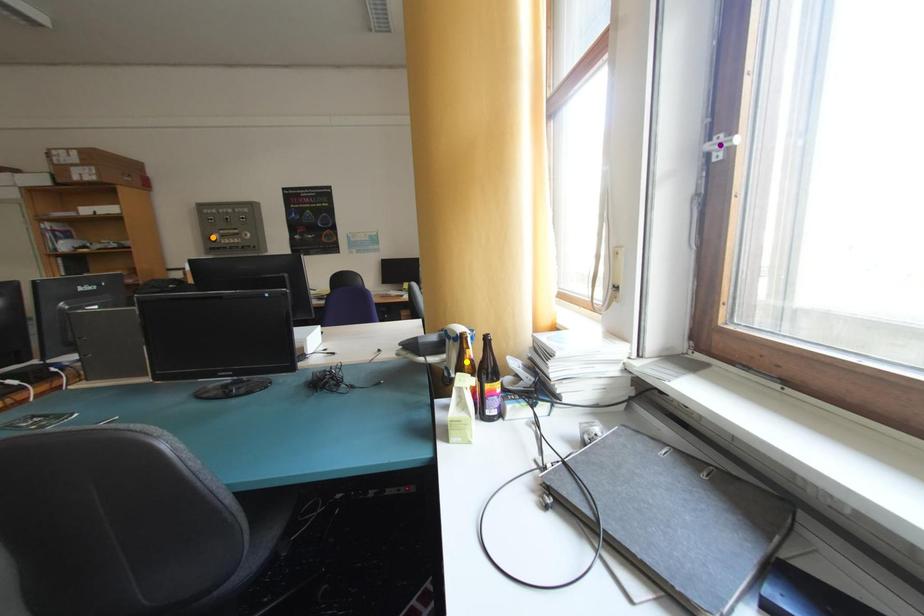
Order these from farthest to nearest:
purple point | yellow point | orange point

orange point, yellow point, purple point